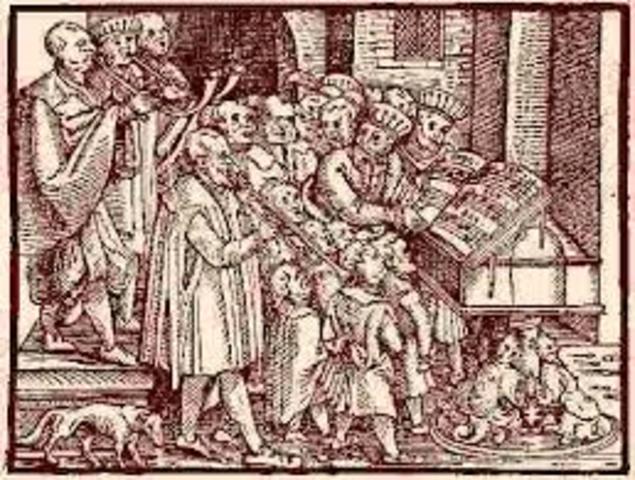
Where is `desk`? desk is located at coordinates (526, 291).